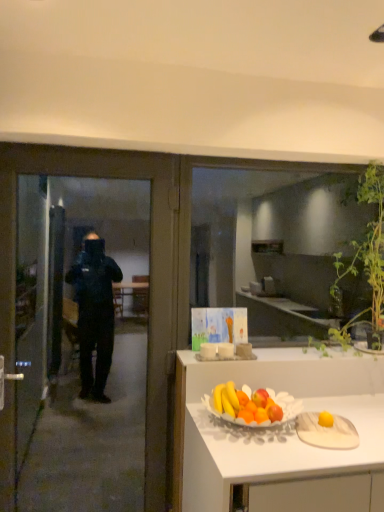
Question: Is transparent glass window at center placed right next to transparent glass door at left?

Choices:
 (A) no
 (B) yes

Answer: (A)

Question: Can you confirm if transparent glass window at center is wider than transparent glass door at left?

Choices:
 (A) yes
 (B) no

Answer: (B)

Question: Considering the relative positions of transparent glass window at center and transparent glass door at left in the image provided, is transparent glass window at center to the right of transparent glass door at left from the viewer's perspective?

Choices:
 (A) no
 (B) yes

Answer: (B)

Question: Is transparent glass window at center further to camera compared to transparent glass door at left?

Choices:
 (A) no
 (B) yes

Answer: (B)

Question: Does transparent glass window at center have a smaller size compared to transparent glass door at left?

Choices:
 (A) no
 (B) yes

Answer: (B)

Question: Does point (357, 289) appear closer or farther from the camera than point (152, 438)?

Choices:
 (A) closer
 (B) farther

Answer: (A)

Question: Relative to transparent glass door at left, is transparent glass window at center in front or behind?

Choices:
 (A) behind
 (B) front

Answer: (A)

Question: From a real-world perspective, is transparent glass window at center positioned above or below transparent glass door at left?

Choices:
 (A) below
 (B) above

Answer: (B)

Question: Is transparent glass window at center wider or thinner than transparent glass door at left?

Choices:
 (A) thin
 (B) wide

Answer: (A)

Question: Considering the positions of transparent glass door at left and transparent glass window at center in the image, is transparent glass door at left bigger or smaller than transparent glass window at center?

Choices:
 (A) big
 (B) small

Answer: (A)

Question: Is transparent glass door at left inside the boundaries of transparent glass window at center, or outside?

Choices:
 (A) inside
 (B) outside

Answer: (B)

Question: Considering their positions, is transparent glass door at left located in front of or behind transparent glass window at center?

Choices:
 (A) behind
 (B) front

Answer: (B)

Question: Is transparent glass door at left taller or shorter than transparent glass window at center?

Choices:
 (A) tall
 (B) short

Answer: (A)

Question: Considering the positions of point (345, 336) and point (203, 196), is point (345, 336) closer or farther from the camera than point (203, 196)?

Choices:
 (A) closer
 (B) farther

Answer: (A)

Question: Is green leafy plant at upper right taller or shorter than transparent glass window at center?

Choices:
 (A) short
 (B) tall

Answer: (A)